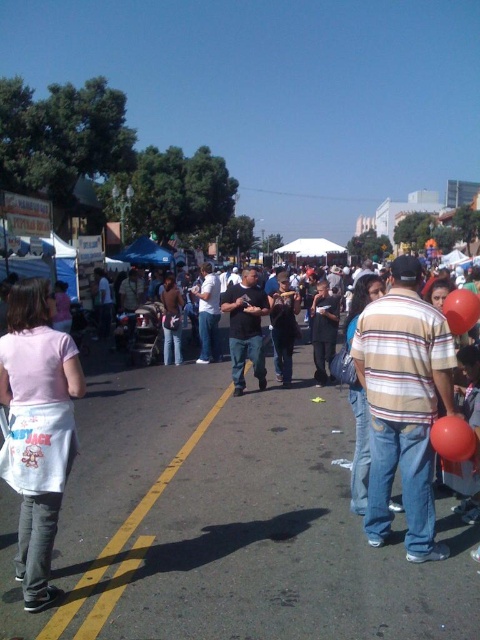
Question: Which of the following is the farthest from the observer?

Choices:
 (A) dark gray shirt at center
 (B) white cotton apron at lower left
 (C) dark gray jeans at center

Answer: (C)

Question: In this image, where is black matte shirt at center located relative to dark brown leather jacket at center?

Choices:
 (A) left
 (B) right

Answer: (B)

Question: Based on their relative distances, which object is nearer to the rubber balloon at center right?

Choices:
 (A) dark gray shirt at center
 (B) white cotton apron at lower left
 (C) dark brown leather jacket at center

Answer: (B)

Question: Among these points, which one is nearest to the camera?

Choices:
 (A) pyautogui.click(x=16, y=388)
 (B) pyautogui.click(x=408, y=257)
 (C) pyautogui.click(x=230, y=285)
 (D) pyautogui.click(x=436, y=428)

Answer: (A)

Question: Can you confirm if striped cotton shirt at center is thinner than white cotton apron at lower left?

Choices:
 (A) no
 (B) yes

Answer: (A)

Question: Can you confirm if dark gray jeans at center is thinner than rubber balloon at center right?

Choices:
 (A) yes
 (B) no

Answer: (A)